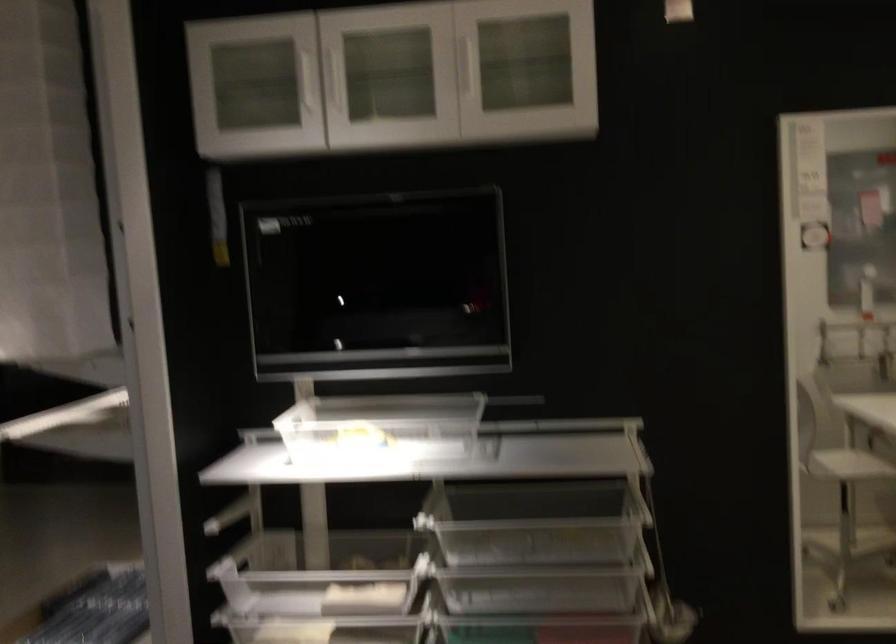
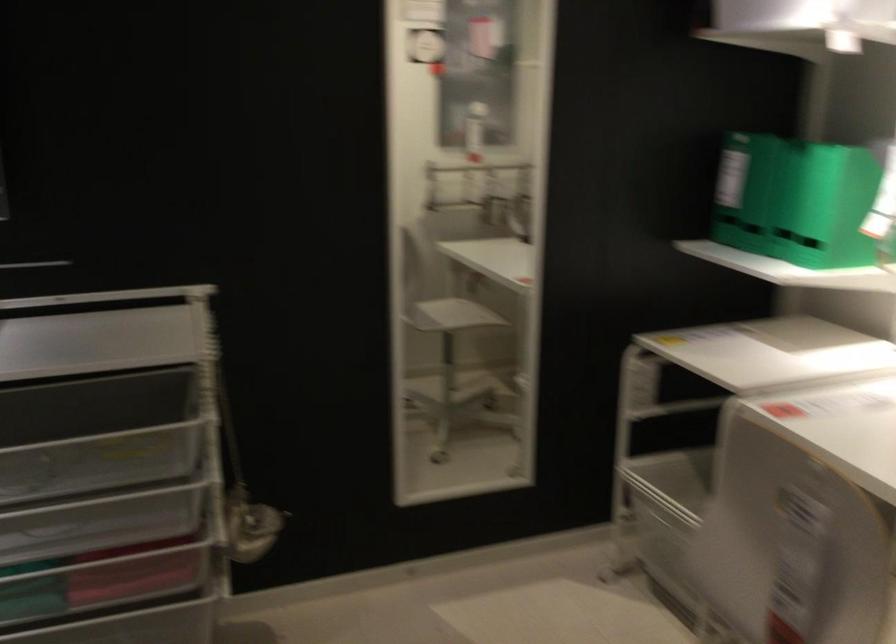
Question: How did the camera likely rotate?

Choices:
 (A) Left
 (B) Right
 (C) Up
 (D) Down

Answer: (B)